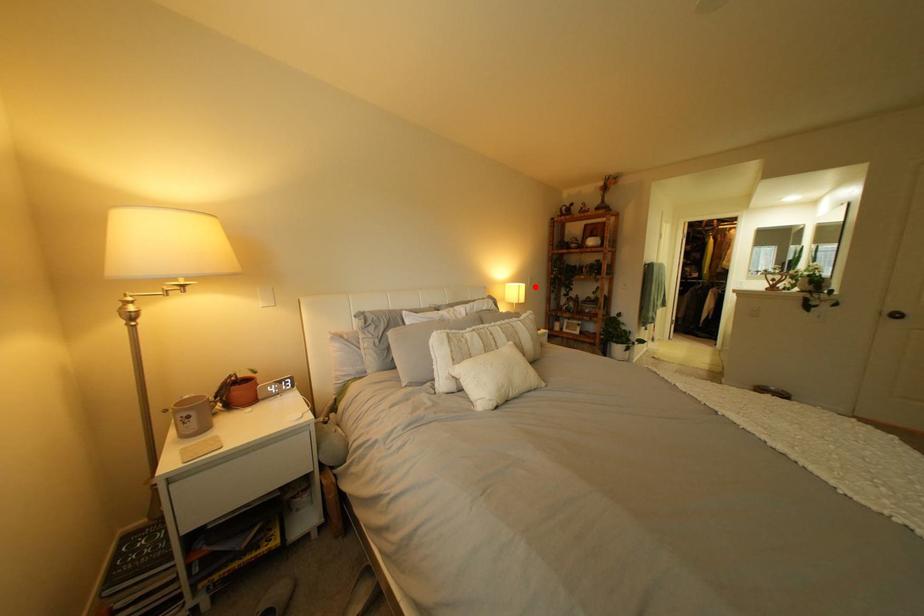
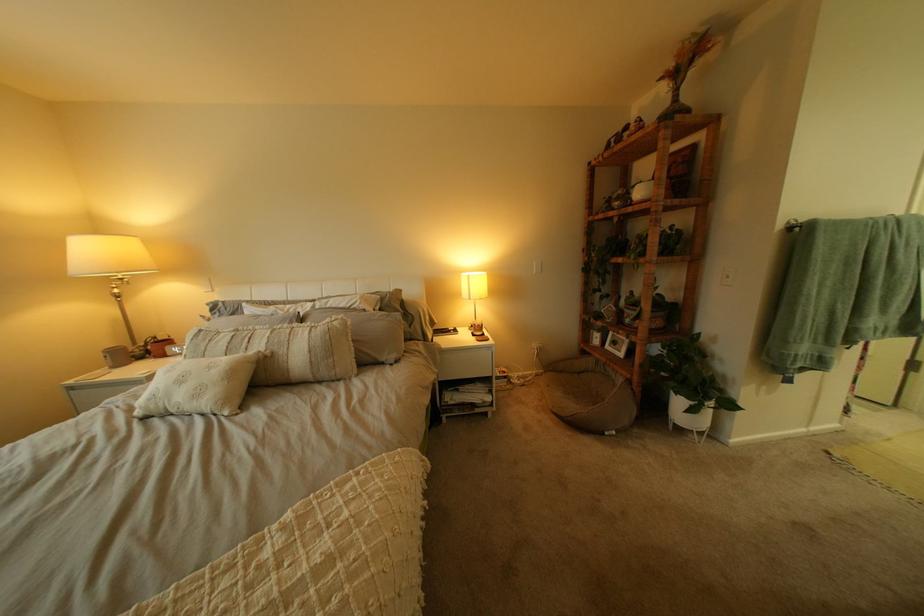
Question: I am providing you with two images of the same scene from different viewpoints. Given a red point in image1, look at the same physical point in image2. Is it:

Choices:
 (A) Closer to the viewpoint
 (B) Farther from the viewpoint

Answer: (B)